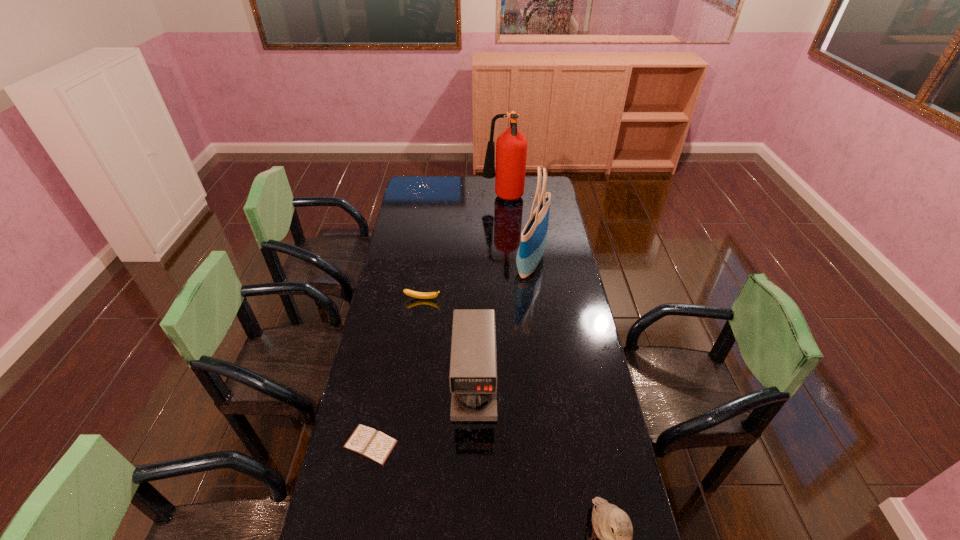
Where is `fire extinguisher`? fire extinguisher is located at coordinates (511, 147).

What are the coordinates of `tote bag` in the screenshot? It's located at (534, 236).

The height and width of the screenshot is (540, 960). I want to click on the fourth farthest object, so click(x=473, y=363).

Locate an element on the screen. This screenshot has height=540, width=960. the second shortest object is located at coordinates (421, 295).

The image size is (960, 540). Find the location of `the fourth nearest object`. the fourth nearest object is located at coordinates (421, 295).

Find the location of a particular element. the shortest object is located at coordinates (375, 445).

Image resolution: width=960 pixels, height=540 pixels. In order to click on the second nearest object in this screenshot , I will do [375, 445].

Where is `free point located 0.340m at the nozzle of the farthest object`? Image resolution: width=960 pixels, height=540 pixels. free point located 0.340m at the nozzle of the farthest object is located at coordinates click(x=420, y=199).

This screenshot has height=540, width=960. What are the coordinates of `vacant region located at the nozzle of the farthest object` in the screenshot? It's located at (455, 199).

Where is `vacant area situated 0.100m at the nozzle of the farthest object`? vacant area situated 0.100m at the nozzle of the farthest object is located at coordinates (464, 199).